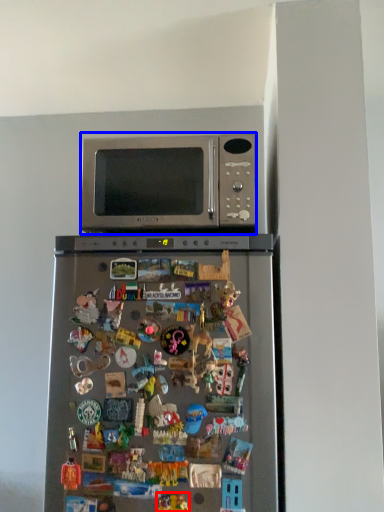
Question: Among these objects, which one is nearest to the camera, toy (highlighted by a red box) or microwave oven (highlighted by a blue box)?

Choices:
 (A) toy
 (B) microwave oven

Answer: (A)